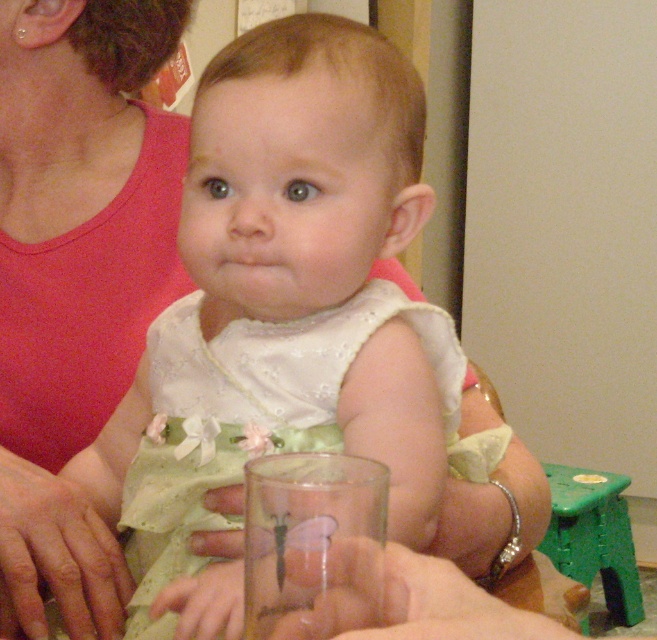
You are a photographer setting up for a photoshoot. The scene includes a baby in a light green outfit with pink bows and a person in a red sleeveless top holding them. There is also a white satin dress at center. Where exactly is the white satin dress positioned in relation to the other elements in the scene?

The white satin dress at center is located at point coordinates 0.430 on the x and 0.455 on the y axis, as specified in the description.

You are looking at the image and want to determine the relative positions of two points. Which point is nearer to you, point (x=351, y=116) or point (x=74, y=300)?

Point (x=351, y=116) is closer to the viewer than point (x=74, y=300).